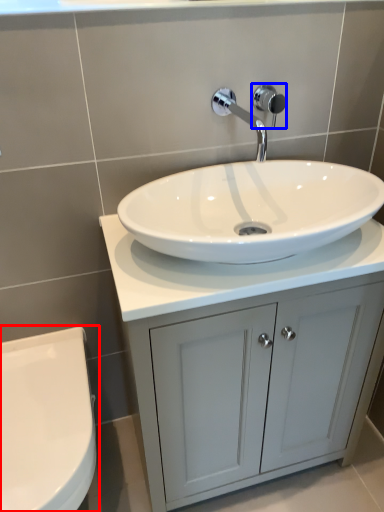
Question: Among these objects, which one is nearest to the camera, toilet (highlighted by a red box) or shower (highlighted by a blue box)?

Choices:
 (A) toilet
 (B) shower

Answer: (A)